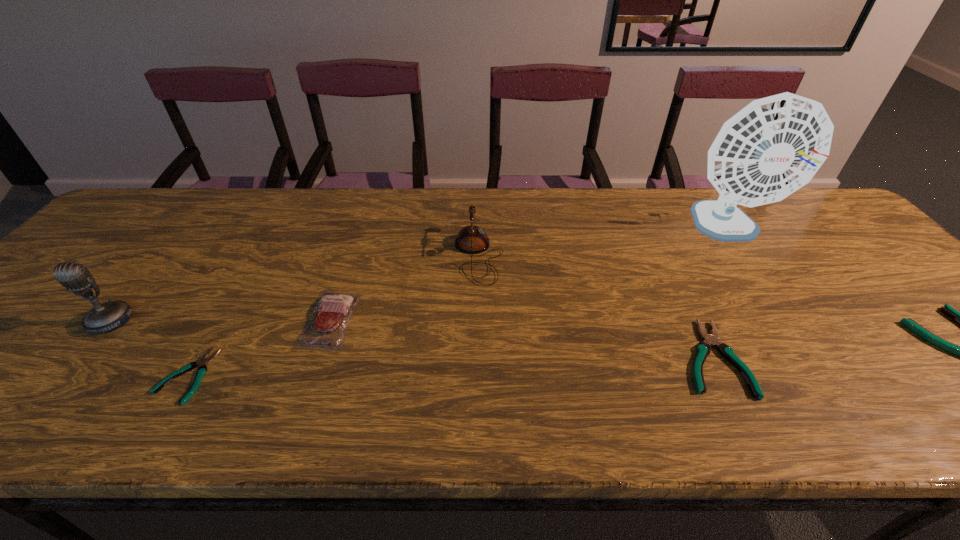
The width and height of the screenshot is (960, 540). Identify the location of vacant space at the far edge of the desktop. (267, 208).

The height and width of the screenshot is (540, 960). In order to click on free space at the near edge of the desktop in this screenshot , I will do `click(160, 370)`.

The height and width of the screenshot is (540, 960). In the image, there is a desktop. Find the location of `vacant space at the left edge`. vacant space at the left edge is located at coordinates [139, 241].

Find the location of a particular element. The height and width of the screenshot is (540, 960). vacant space at the right edge of the desktop is located at coordinates tap(879, 321).

The image size is (960, 540). I want to click on vacant region at the far left corner, so click(x=164, y=212).

This screenshot has height=540, width=960. Identify the location of free spot at the near left corner of the desktop. (32, 366).

Where is `free region at the far right corner of the desktop`? This screenshot has width=960, height=540. free region at the far right corner of the desktop is located at coordinates (804, 203).

Image resolution: width=960 pixels, height=540 pixels. I want to click on free space between the sixth object from left to right and the third tallest object, so click(x=603, y=242).

Identify the location of vacant point located between the sixth tallest object and the leftmost object. (411, 339).

Find the location of `vacant area between the leftmost pliers and the steak`. vacant area between the leftmost pliers and the steak is located at coordinates (258, 347).